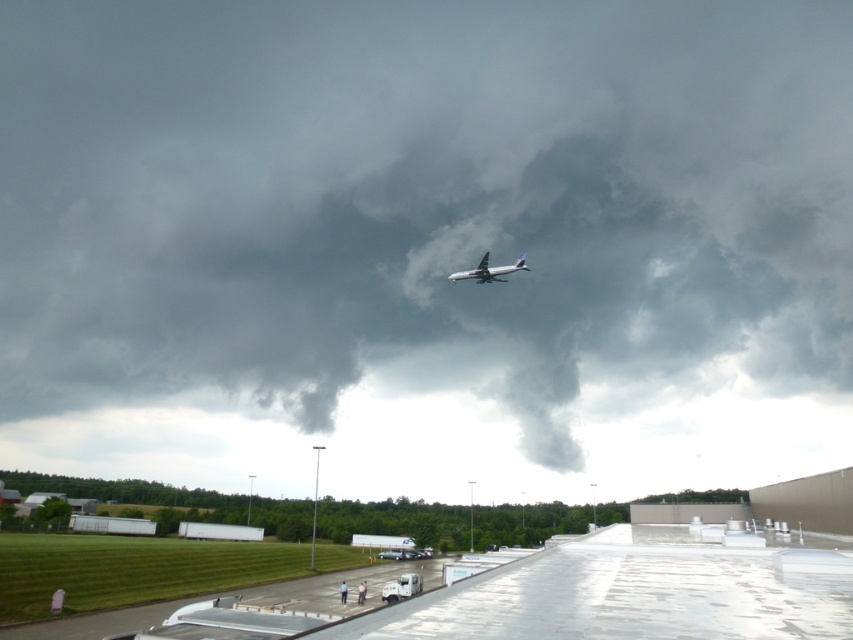
You are a pilot preparing for takeoff and notice the dark gray cloud at upper center and the white glossy airplane at upper center in the sky. Which object is higher in the sky?

The dark gray cloud at upper center is taller than the white glossy airplane at upper center, so the dark gray cloud at upper center is higher in the sky.

You are a pilot preparing to land your aircraft. You notice a dark gray cloud at upper center and a white glossy airplane at upper center in the sky. Which object is closer to your current altitude?

The dark gray cloud at upper center is closer to your current altitude because the white glossy airplane at upper center is positioned behind it, indicating the cloud is nearer.

You are an air traffic controller observing the sky. You notice the dark gray cloud at upper center and the white glossy airplane at upper center. Which object has a wider horizontal span from your viewpoint?

The dark gray cloud at upper center has a wider horizontal span than the white glossy airplane at upper center.